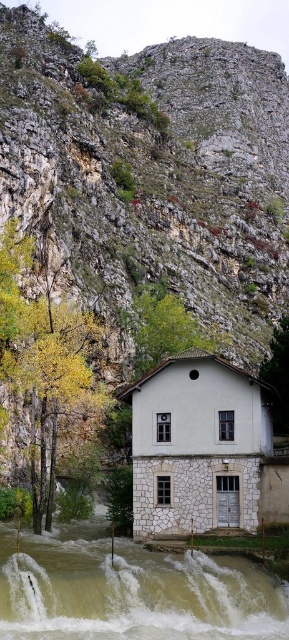
You are a hiker standing at the base of the cliff. You see the brown stone river at lower center and the green leafy tree at center. Which object is closer to you?

The brown stone river at lower center is closer to you because it is positioned in front of the green leafy tree at center.

You are standing at the base of the cliff and want to cross the brown stone river at lower center to reach the green leafy tree at center. Considering the height difference between them, can you safely step from the river to the tree without needing a ladder?

The brown stone river at lower center has a lesser height compared to the green leafy tree at center, so stepping up from the river to the tree might be possible without a ladder since the tree is higher. However, the actual feasibility depends on the slope and terrain between them, which aren